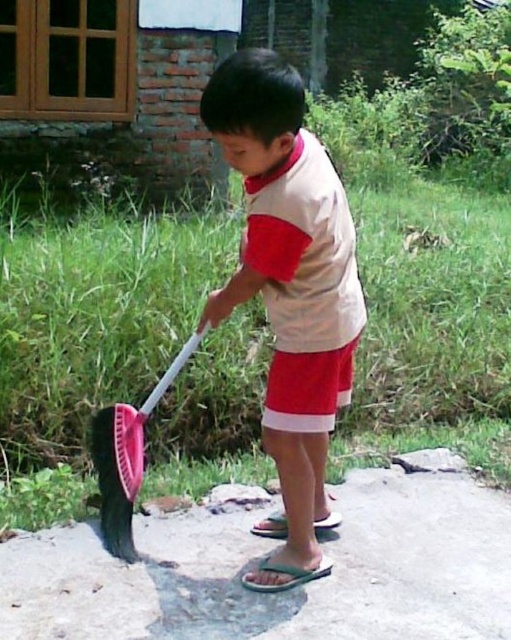
At what (x,y) coordinates should I click in order to perform the action: click on green grass at lower left. Please return your answer as a coordinate pair (x, y). This screenshot has width=511, height=640. Looking at the image, I should click on (89, 340).

Does green grass at lower left have a lesser height compared to smooth concrete pavement at lower center?

Incorrect, green grass at lower left's height does not fall short of smooth concrete pavement at lower center's.

Find the location of `green grass at lower left`. green grass at lower left is located at coordinates (89, 340).

Can you confirm if pink plastic shovel at lower left is smaller than red cotton shorts at center?

Incorrect, pink plastic shovel at lower left is not smaller in size than red cotton shorts at center.

Between pink plastic shovel at lower left and red cotton shorts at center, which one has less height?

With less height is red cotton shorts at center.

Is point (100, 484) positioned in front of point (329, 384)?

No, (100, 484) is further to viewer.

The image size is (511, 640). Find the location of `pink plastic shovel at lower left`. pink plastic shovel at lower left is located at coordinates (127, 458).

Can you confirm if smooth concrete pavement at lower center is wider than red cotton shorts at center?

Yes.

Where is `smooth concrete pavement at lower center`? smooth concrete pavement at lower center is located at coordinates (266, 552).

In order to click on smooth concrete pavement at lower center in this screenshot , I will do `click(266, 552)`.